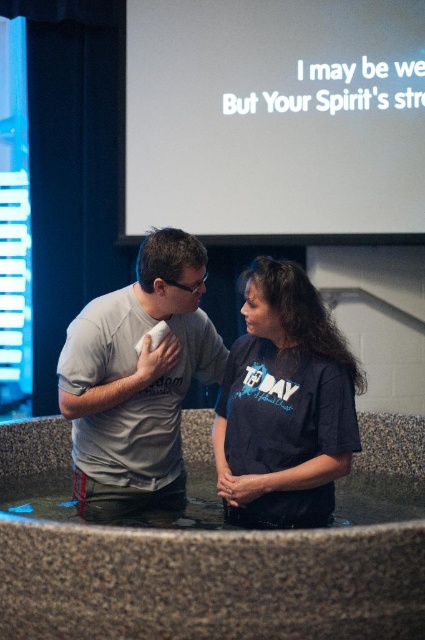
Question: Considering the real-world distances, which object is closest to the white matte projection screen at upper center?

Choices:
 (A) dark blue t-shirt at center
 (B) gray matte t-shirt at center

Answer: (B)

Question: Which point appears closest to the camera in this image?

Choices:
 (A) (408, 113)
 (B) (173, 376)
 (C) (257, 504)

Answer: (C)

Question: In this image, where is white matte projection screen at upper center located relative to dark blue t-shirt at center?

Choices:
 (A) left
 (B) right

Answer: (B)

Question: Can you confirm if gray matte t-shirt at center is bigger than dark blue t-shirt at center?

Choices:
 (A) no
 (B) yes

Answer: (B)

Question: Among these objects, which one is nearest to the camera?

Choices:
 (A) dark blue t-shirt at center
 (B) white matte projection screen at upper center

Answer: (A)

Question: Does white matte projection screen at upper center appear over dark blue t-shirt at center?

Choices:
 (A) yes
 (B) no

Answer: (A)